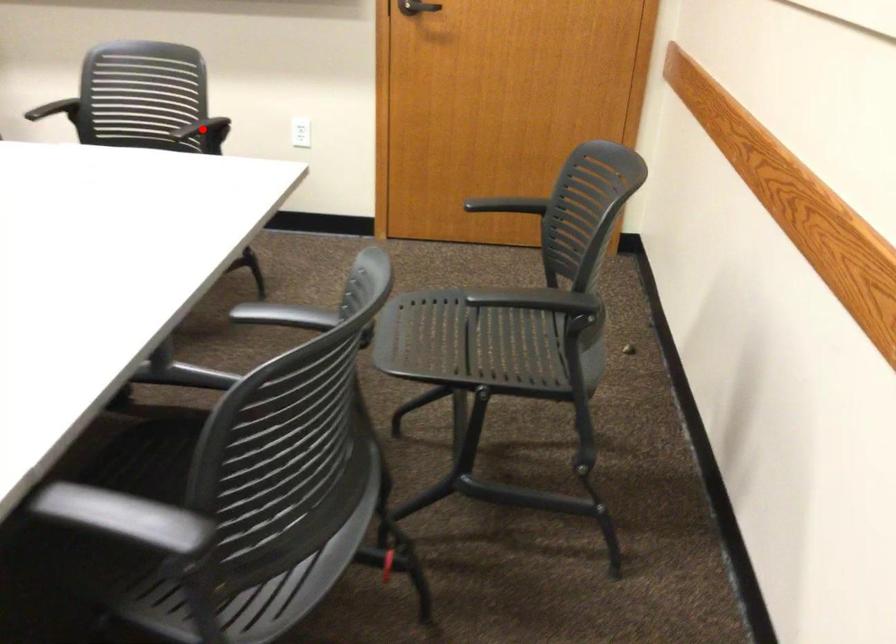
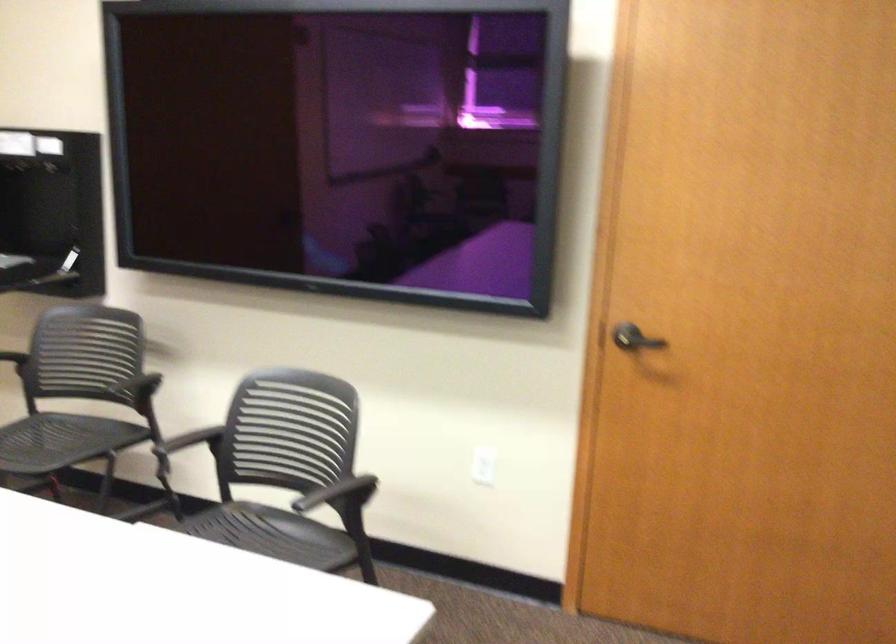
Locate, in the second image, the point that corresponds to the highlighted location in the first image.

(337, 493)